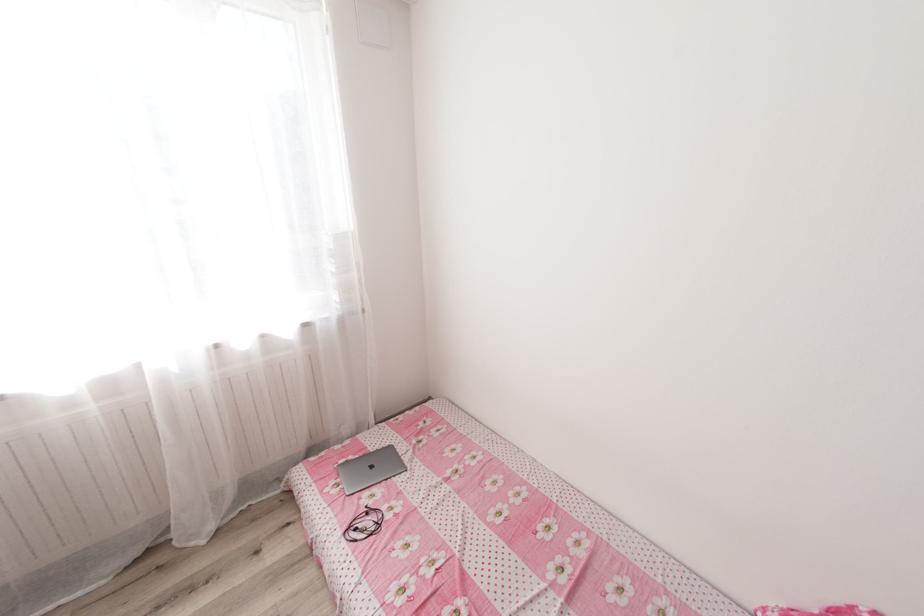
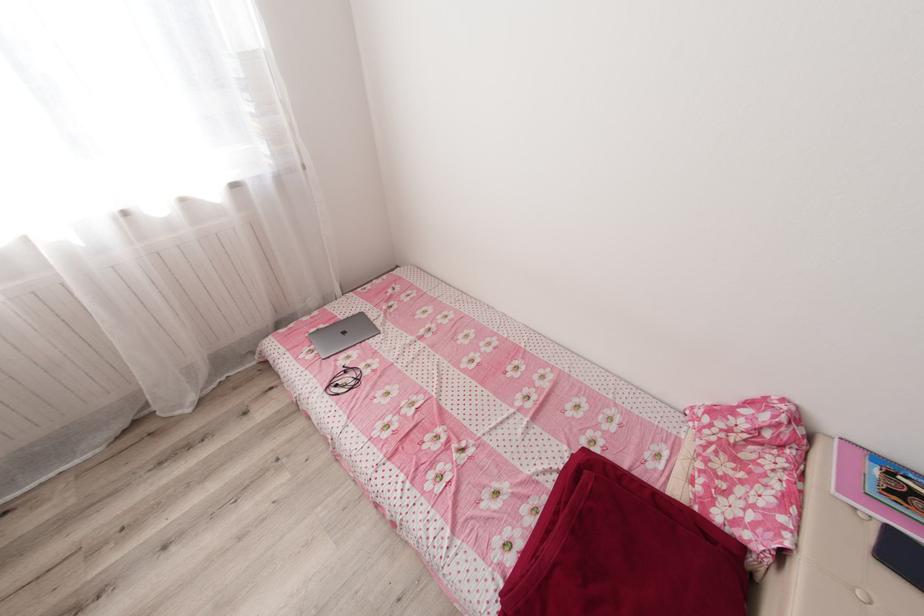
Where in the second image is the point corresponding to pixel 373 522 from the first image?

(353, 379)